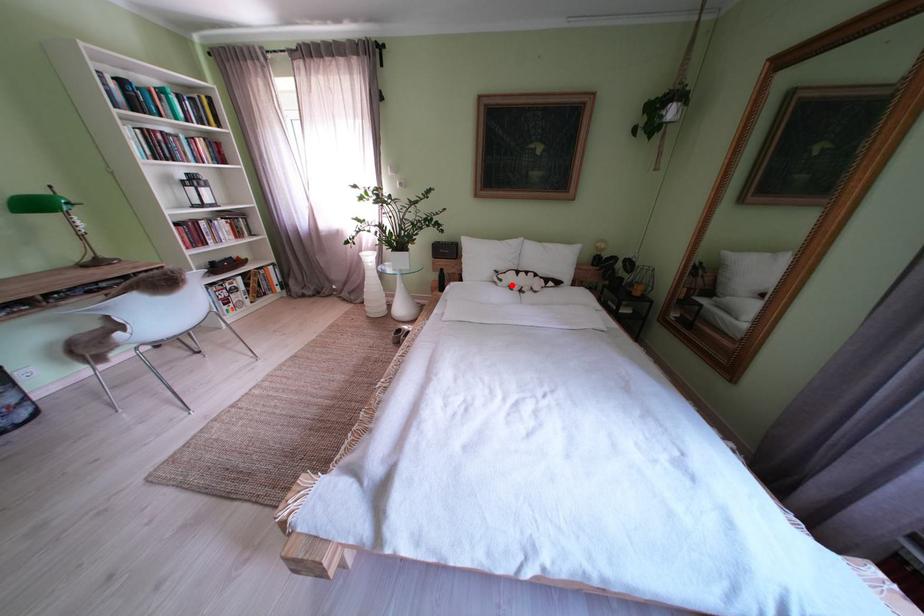
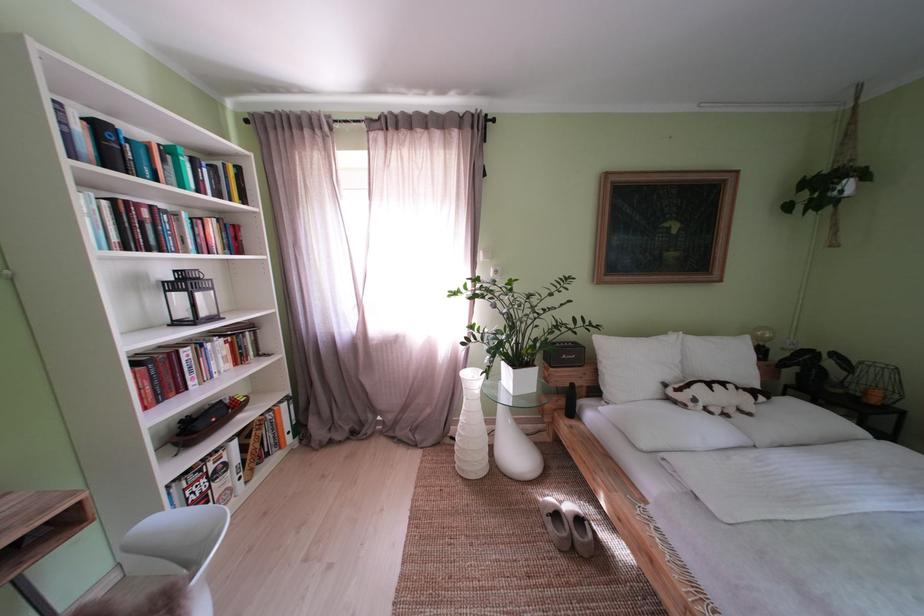
In the second image, find the point that corresponds to the highlighted location in the first image.

(706, 406)